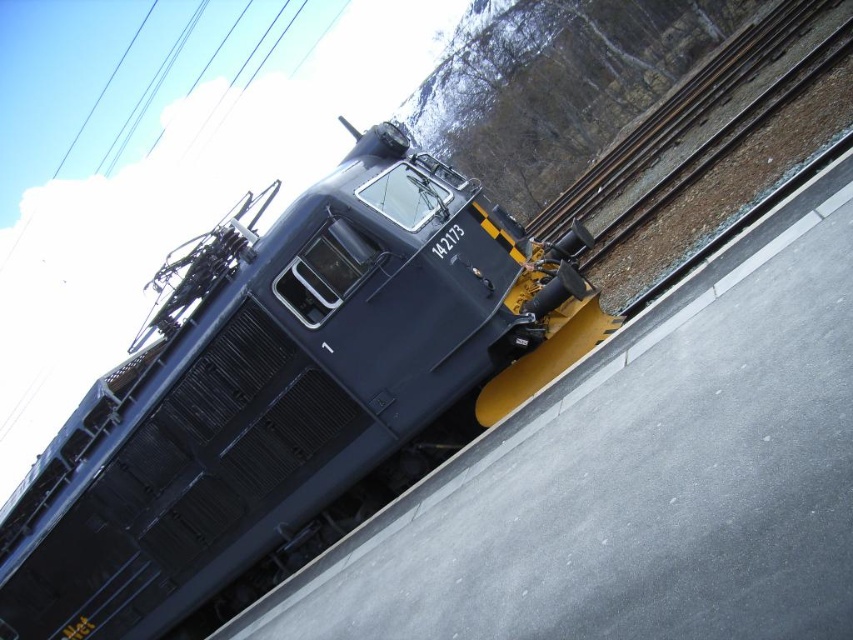
Does matte black train at center have a lesser height compared to metal/rough train track at center-right?

Yes.

From the picture: Is matte black train at center further to the viewer compared to metal/rough train track at center-right?

No, it is in front of metal/rough train track at center-right.

Which is in front, point (38, 637) or point (704, 150)?

Point (38, 637) is in front.

Where is `matte black train at center`? matte black train at center is located at coordinates (288, 396).